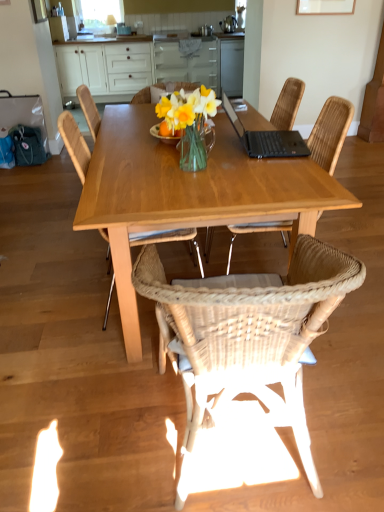
Identify the location of free space to the left of woven rattan chair at center, arranged as the 2th chair when viewed from the left. (94, 424).